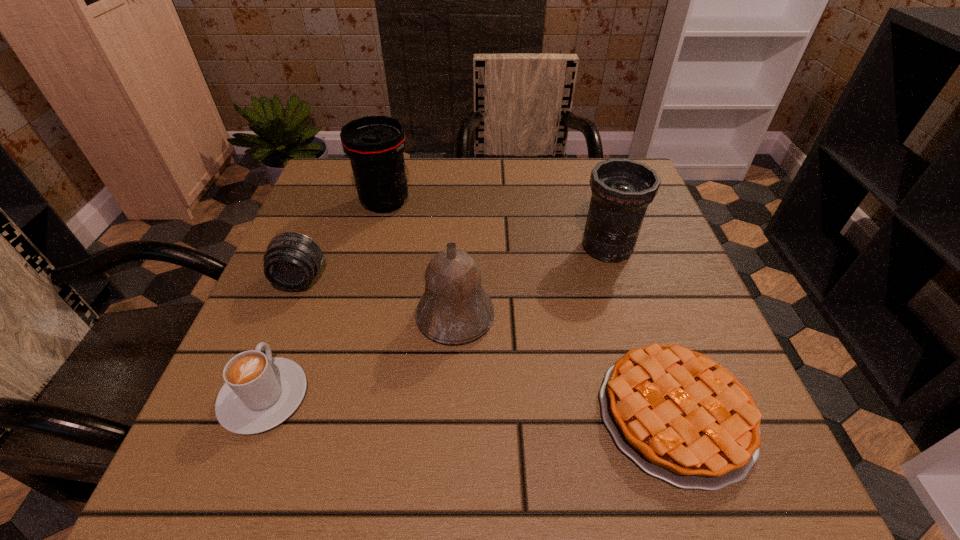
Identify the location of vacant space located 0.210m on the right of the bell. (610, 316).

Locate an element on the screen. This screenshot has height=540, width=960. vacant space located at the front element of the leftmost telephoto lens is located at coordinates (272, 350).

Identify the location of vacant point located to the right of the cappuccino. This screenshot has height=540, width=960. (320, 253).

Locate an element on the screen. This screenshot has height=540, width=960. free space located 0.340m to the right of the cappuccino is located at coordinates (327, 232).

Where is `vacant space located 0.330m to the right of the cappuccino`? The height and width of the screenshot is (540, 960). vacant space located 0.330m to the right of the cappuccino is located at coordinates (326, 234).

Identify the location of blank area located 0.100m on the back of the pie. This screenshot has height=540, width=960. (639, 307).

This screenshot has height=540, width=960. In order to click on object at the far edge in this screenshot , I will do [x=375, y=144].

The height and width of the screenshot is (540, 960). I want to click on cappuccino that is at the near edge, so click(x=260, y=392).

I want to click on pie that is at the near edge, so click(681, 417).

Where is `cappuccino that is positioned at the left edge`? The image size is (960, 540). cappuccino that is positioned at the left edge is located at coordinates (260, 392).